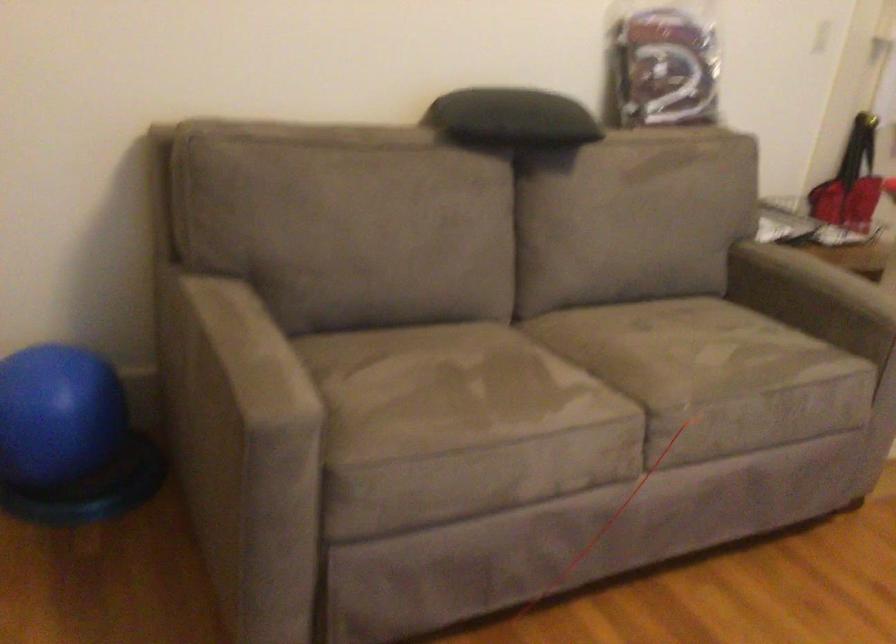
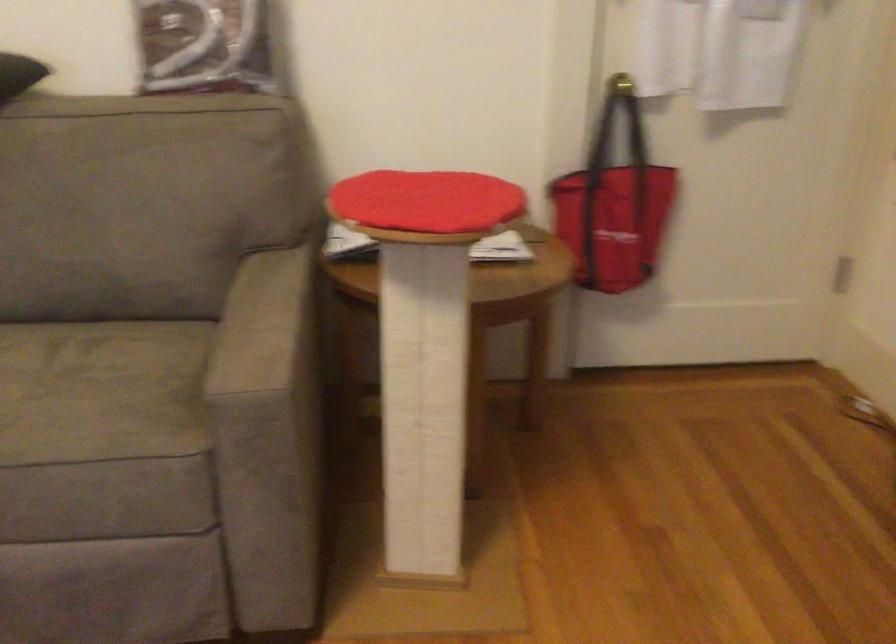
The images are taken continuously from a first-person perspective. In which direction are you moving?

The movement direction of the cameraman is right, forward.